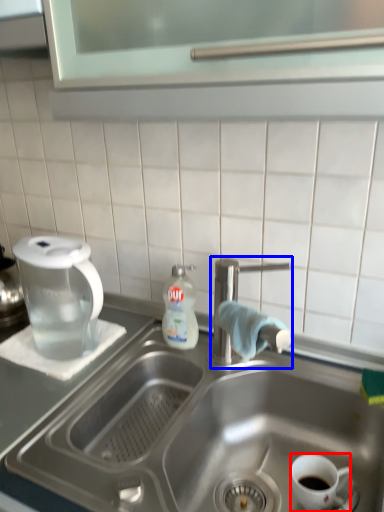
Question: Which point is further to the camera, coffee cup (highlighted by a red box) or tap (highlighted by a blue box)?

Choices:
 (A) coffee cup
 (B) tap

Answer: (B)